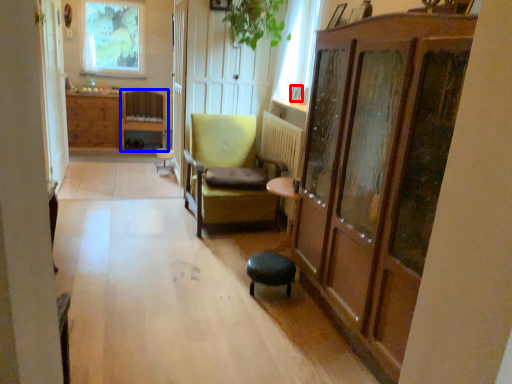
Question: Which object appears closest to the camera in this image, picture frame (highlighted by a red box) or chair (highlighted by a blue box)?

Choices:
 (A) picture frame
 (B) chair

Answer: (A)